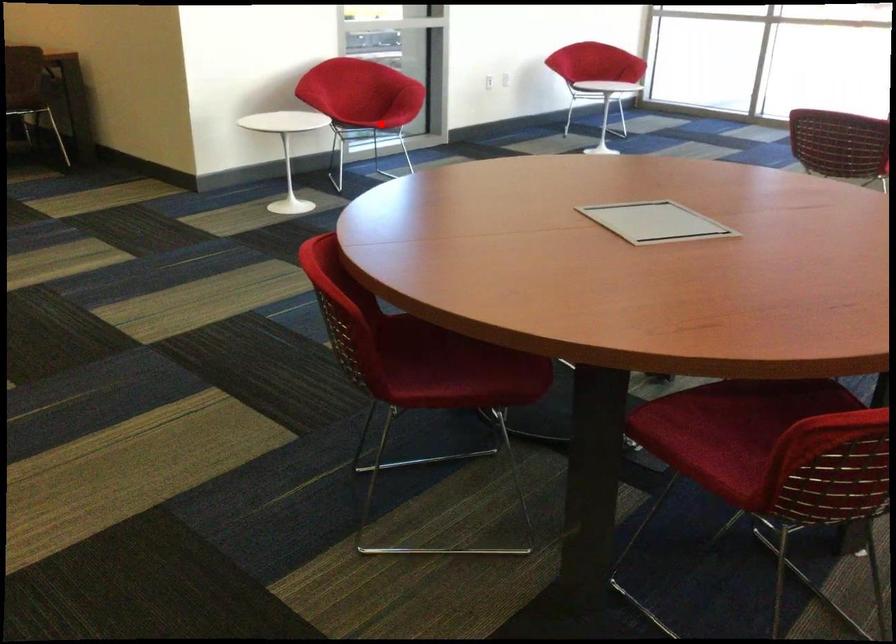
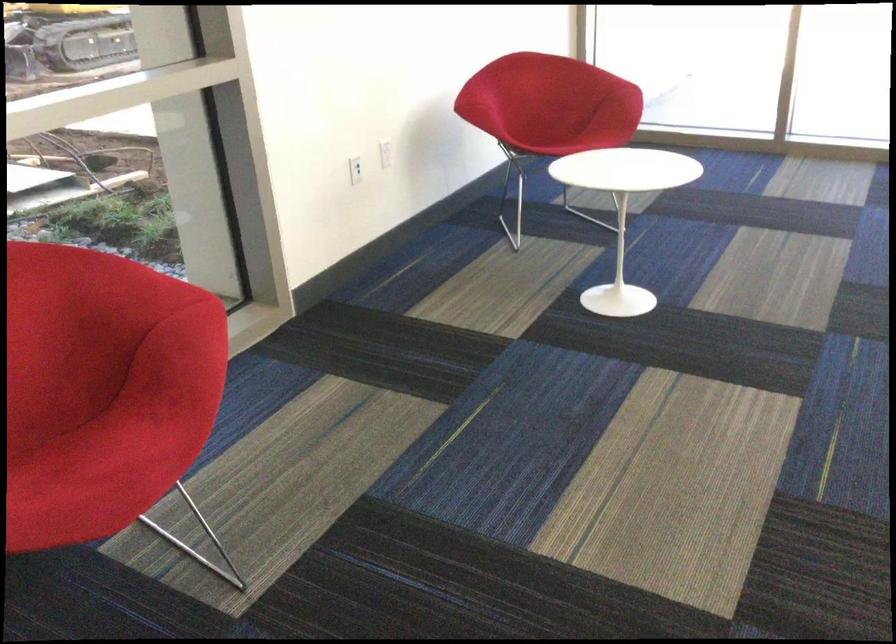
In the second image, find the point that corresponds to the highlighted location in the first image.

(115, 450)